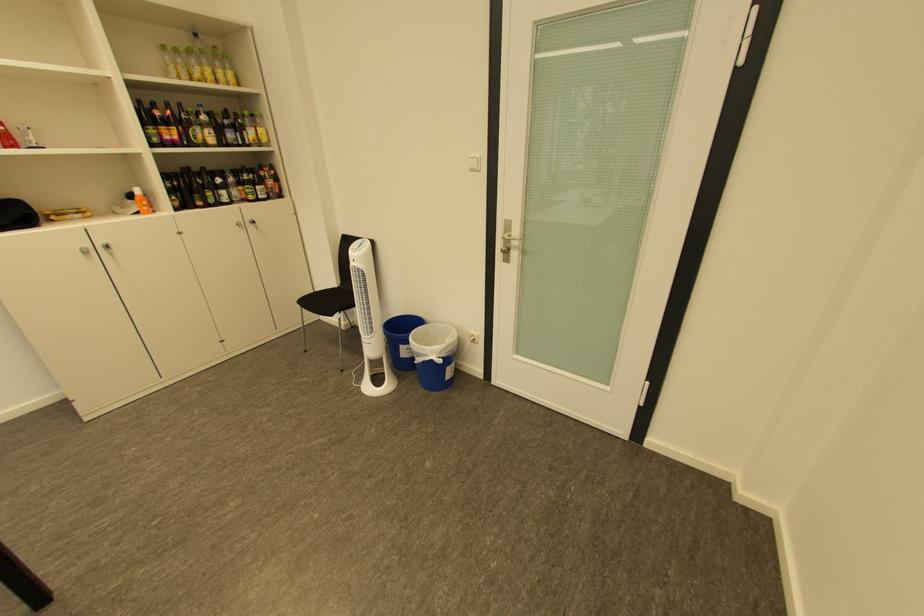
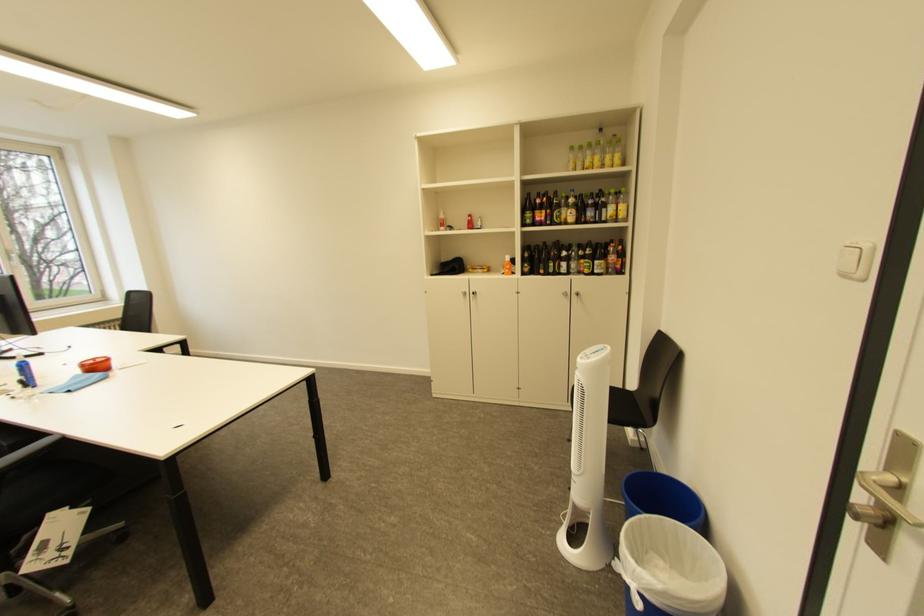
The point at (435, 357) is marked in the first image. Where is the corresponding point in the second image?

(636, 570)